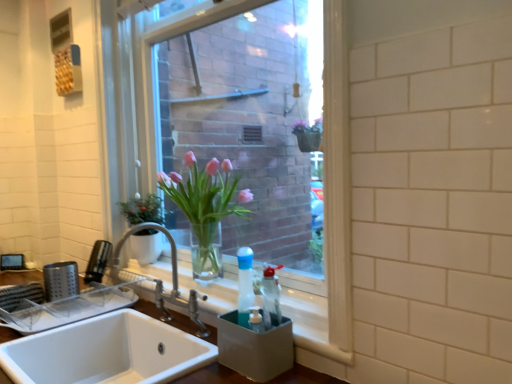
Question: Is white ceramic sink at lower left, the second sink when ordered from bottom to top, in contact with satin nickel faucet at sink left?

Choices:
 (A) yes
 (B) no

Answer: (B)

Question: Is white ceramic sink at lower left, the second sink when ordered from bottom to top, taller than satin nickel faucet at sink left?

Choices:
 (A) yes
 (B) no

Answer: (B)

Question: Does white ceramic sink at lower left, the second sink when ordered from bottom to top, come behind satin nickel faucet at sink left?

Choices:
 (A) yes
 (B) no

Answer: (B)

Question: Is white ceramic sink at lower left, acting as the first sink starting from the top, shorter than satin nickel faucet at sink left?

Choices:
 (A) yes
 (B) no

Answer: (A)

Question: Is satin nickel faucet at sink left at the back of white ceramic sink at lower left, acting as the first sink starting from the top?

Choices:
 (A) no
 (B) yes

Answer: (A)

Question: Can you confirm if white ceramic sink at lower left, which is the first sink in bottom-to-top order, is positioned to the left of satin nickel faucet at sink left?

Choices:
 (A) no
 (B) yes

Answer: (B)

Question: Is the position of white ceramic sink at lower left, placed as the second sink when sorted from top to bottom, less distant than that of satin nickel faucet at sink left?

Choices:
 (A) yes
 (B) no

Answer: (A)

Question: Is white ceramic sink at lower left, placed as the second sink when sorted from top to bottom, wider than satin nickel faucet at sink left?

Choices:
 (A) no
 (B) yes

Answer: (B)

Question: Is white ceramic sink at lower left, placed as the second sink when sorted from top to bottom, taller than satin nickel faucet at sink left?

Choices:
 (A) yes
 (B) no

Answer: (A)

Question: From a real-world perspective, is white ceramic sink at lower left, which is the first sink in bottom-to-top order, physically below satin nickel faucet at sink left?

Choices:
 (A) yes
 (B) no

Answer: (A)

Question: Is white ceramic sink at lower left, which is the first sink in bottom-to-top order, facing towards satin nickel faucet at sink left?

Choices:
 (A) yes
 (B) no

Answer: (B)

Question: Considering the relative sizes of white ceramic sink at lower left, placed as the second sink when sorted from top to bottom, and pink glass vase at center in the image provided, is white ceramic sink at lower left, placed as the second sink when sorted from top to bottom, wider than pink glass vase at center?

Choices:
 (A) yes
 (B) no

Answer: (A)